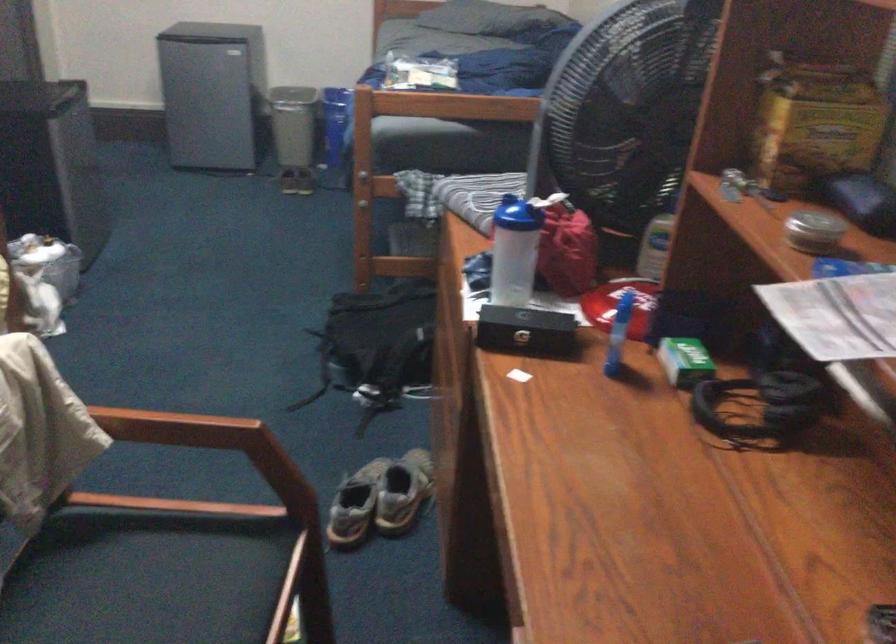
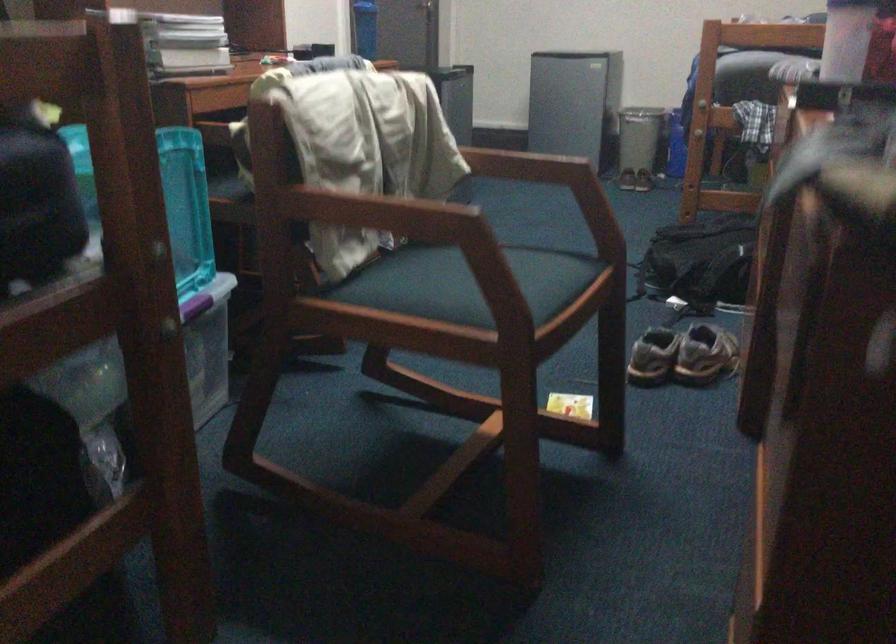
Question: The first image is from the beginning of the video and the second image is from the end. How did the camera likely rotate when shooting the video?

Choices:
 (A) Left
 (B) Right
 (C) Up
 (D) Down

Answer: (A)